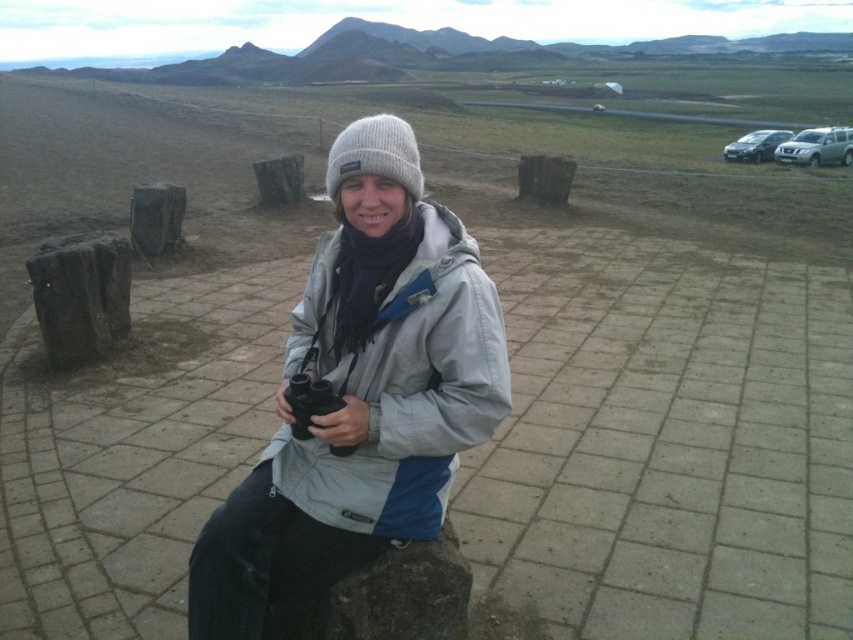
Question: Is black rubber binoculars at center to the right of satin silver suv at upper right from the viewer's perspective?

Choices:
 (A) no
 (B) yes

Answer: (A)

Question: Which of the following is the closest to the observer?

Choices:
 (A) black rubber binoculars at center
 (B) gray fleece jacket at center
 (C) satin silver suv at upper right

Answer: (B)

Question: Does gray fleece jacket at center appear on the left side of satin silver suv at upper right?

Choices:
 (A) no
 (B) yes

Answer: (B)

Question: Considering the relative positions of gray fleece jacket at center and satin silver suv at upper right in the image provided, where is gray fleece jacket at center located with respect to satin silver suv at upper right?

Choices:
 (A) below
 (B) above

Answer: (A)

Question: Among these objects, which one is farthest from the camera?

Choices:
 (A) gray fleece jacket at center
 (B) satin silver suv at upper right
 (C) black rubber binoculars at center

Answer: (B)

Question: Which point appears farthest from the camera in this image?

Choices:
 (A) (303, 404)
 (B) (753, 134)
 (C) (308, 486)
 (D) (824, 163)

Answer: (B)